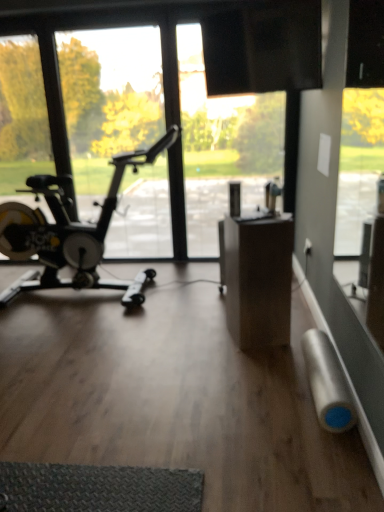
I want to click on vacant area in front of silver matte duct tape at lower right, so click(309, 454).